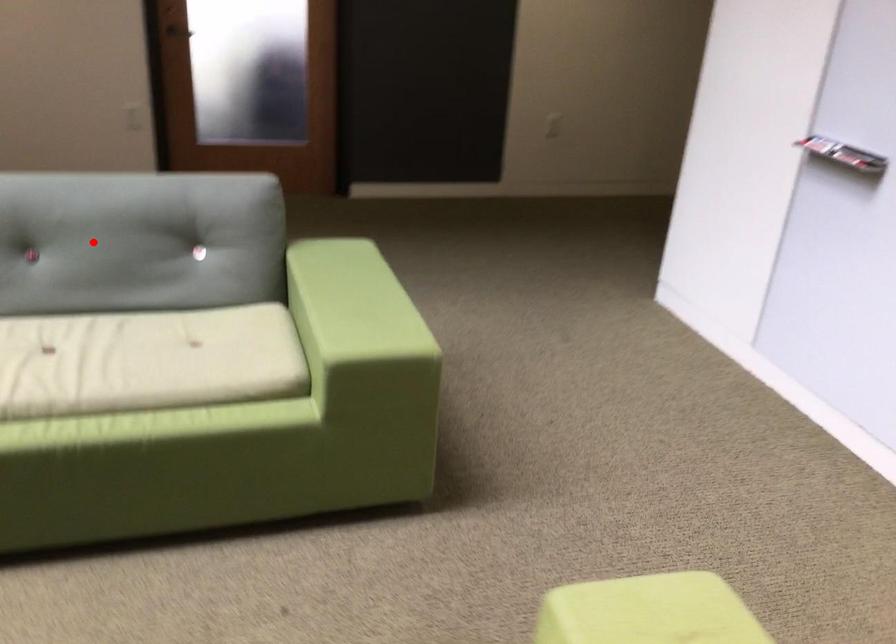
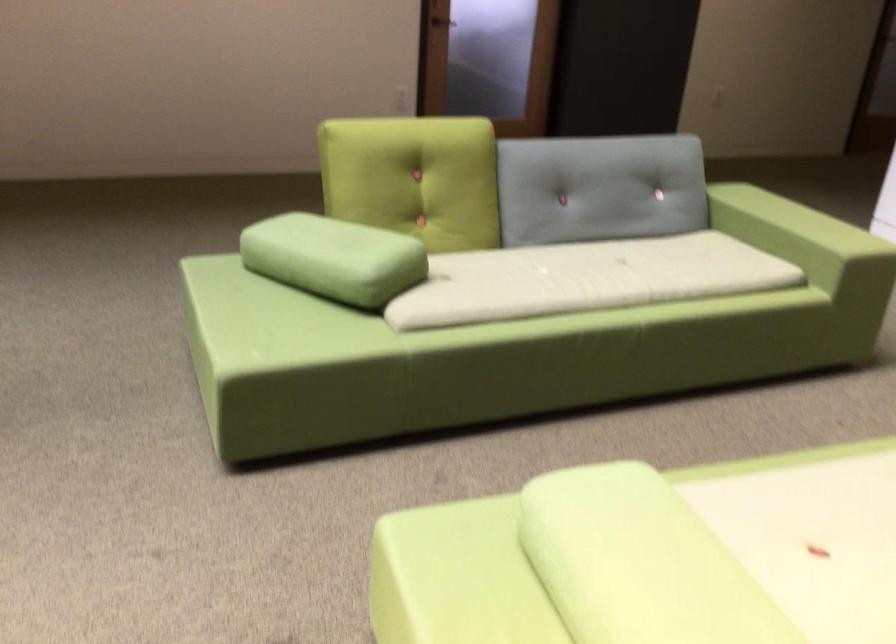
The point at the highlighted location is marked in the first image. Where is the corresponding point in the second image?

(599, 187)